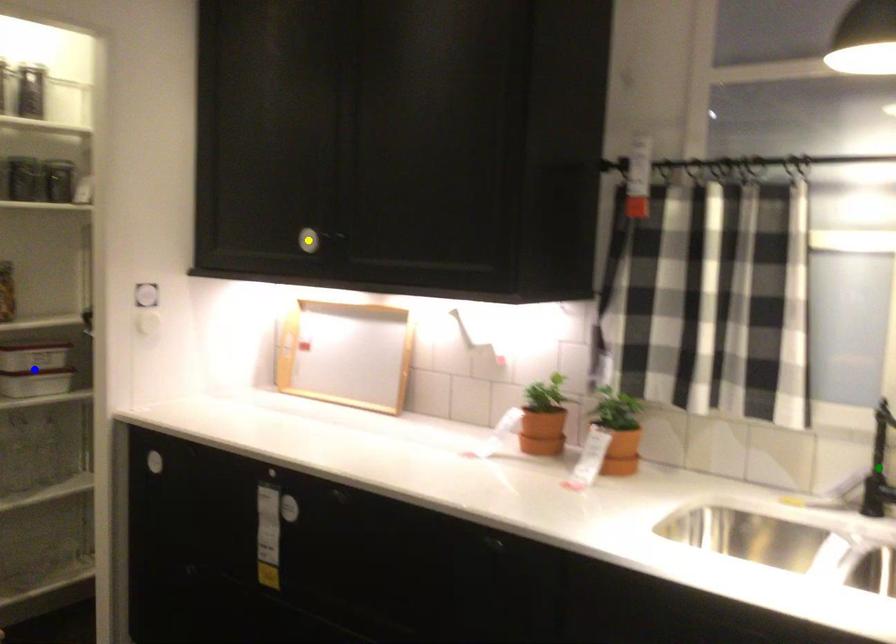
Order these from nearest to farthest:
1. blue point
2. green point
3. yellow point

blue point, yellow point, green point